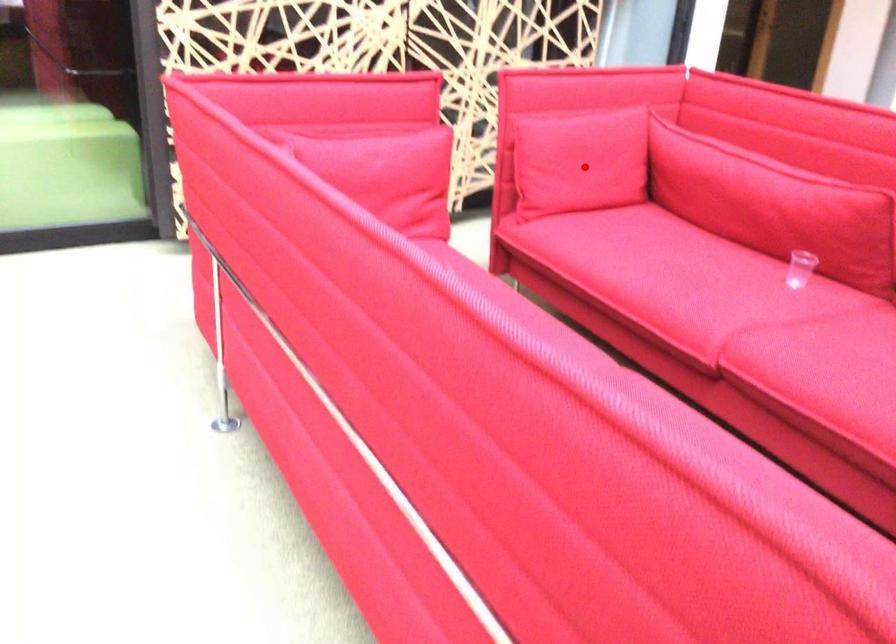
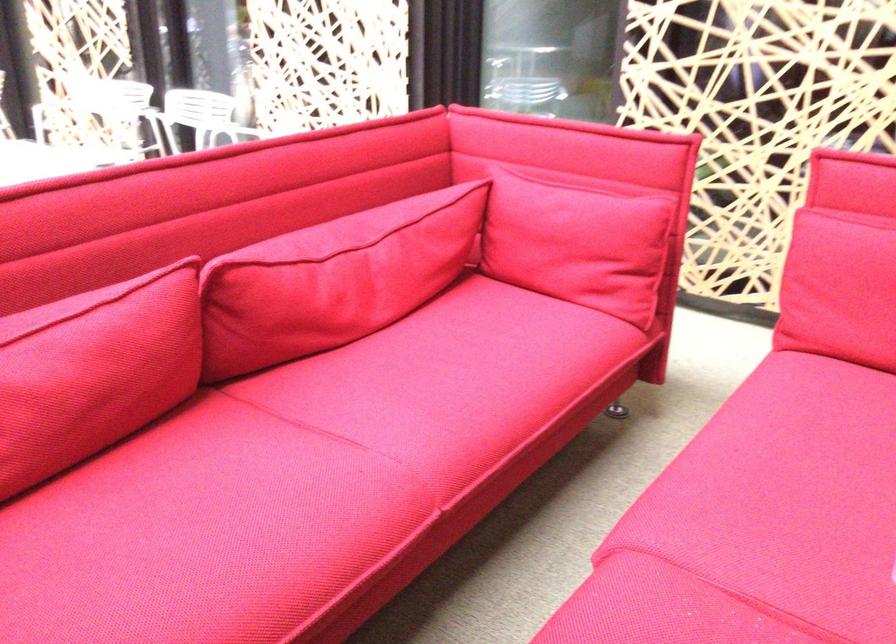
In the second image, find the point that corresponds to the highlighted location in the first image.

(840, 288)